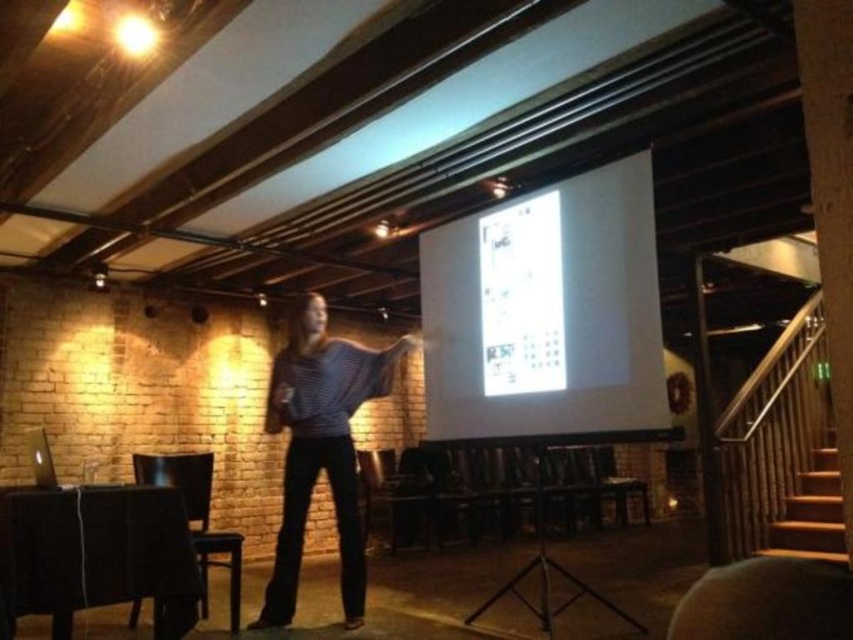
Question: Does white glossy projection screen at upper center have a larger size compared to striped sweater at center?

Choices:
 (A) no
 (B) yes

Answer: (B)

Question: From the image, what is the correct spatial relationship of white glossy projection screen at upper center in relation to striped sweater at center?

Choices:
 (A) below
 (B) above

Answer: (B)

Question: Which point is closer to the camera?

Choices:
 (A) striped sweater at center
 (B) white glossy projection screen at upper center

Answer: (B)

Question: Can you confirm if white glossy projection screen at upper center is positioned to the right of striped sweater at center?

Choices:
 (A) no
 (B) yes

Answer: (B)

Question: Which of the following is the farthest from the observer?

Choices:
 (A) (314, 470)
 (B) (625, 288)

Answer: (A)